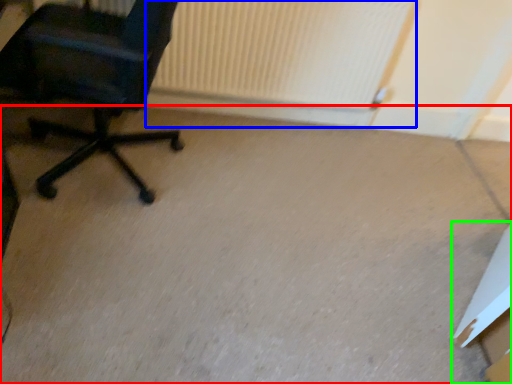
Question: Which object is positioned closest to concrete (highlighted by a red box)? Select from radiator (highlighted by a blue box) and cardboard box (highlighted by a green box).

Choices:
 (A) radiator
 (B) cardboard box

Answer: (B)